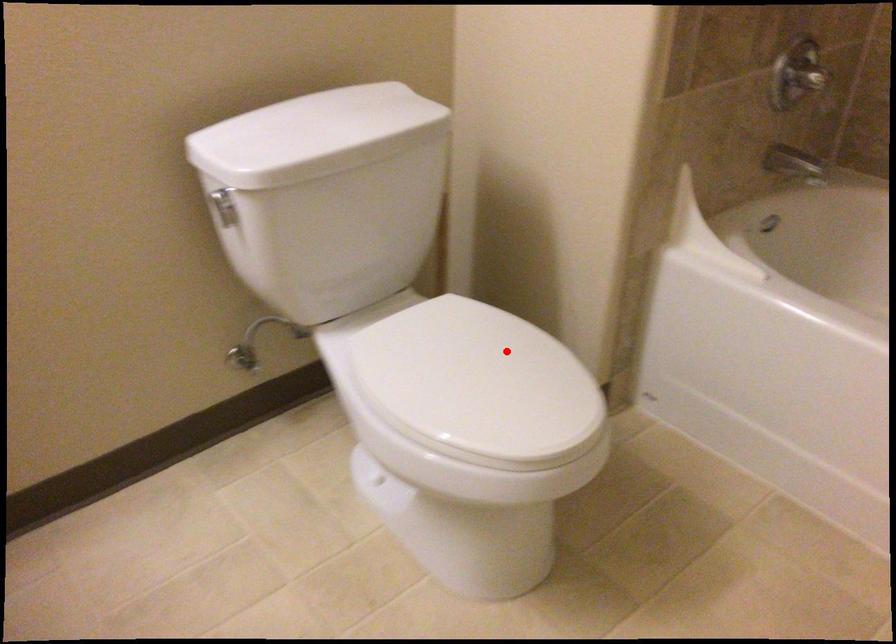
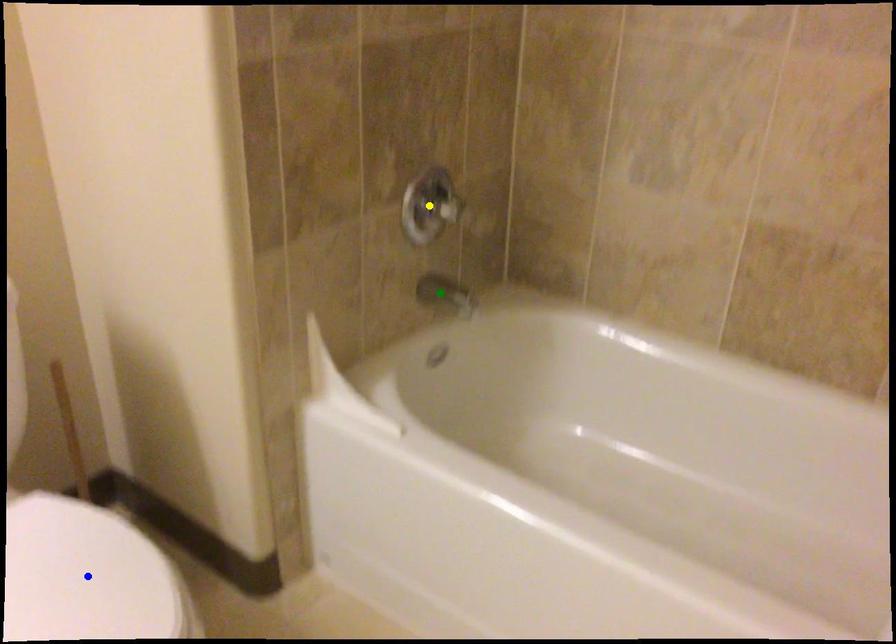
Question: I am providing you with two images of the same scene from different viewpoints. A red point is marked on the first image. You are given multiple points on the second image. Which point in image 2 is actually the same real-world point as the red point in image 1?

Choices:
 (A) yellow point
 (B) blue point
 (C) green point

Answer: (B)